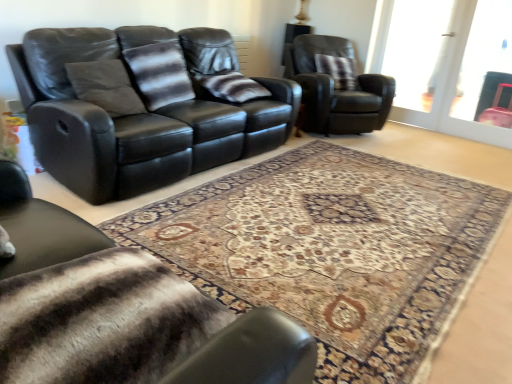
Question: Is patterned carpet at center not within striped fur blanket at lower left, acting as the 2th chair starting from the back?

Choices:
 (A) no
 (B) yes

Answer: (B)

Question: Is patterned carpet at center thinner than striped fur blanket at lower left, the 1th chair from the bottom?

Choices:
 (A) yes
 (B) no

Answer: (B)

Question: Is there a large distance between patterned carpet at center and striped fur blanket at lower left, which ranks as the 1th chair in left-to-right order?

Choices:
 (A) no
 (B) yes

Answer: (B)

Question: From the image's perspective, would you say patterned carpet at center is shown under striped fur blanket at lower left, acting as the 2th chair starting from the back?

Choices:
 (A) no
 (B) yes

Answer: (A)

Question: Is patterned carpet at center with striped fur blanket at lower left, acting as the 2th chair starting from the back?

Choices:
 (A) yes
 (B) no

Answer: (B)

Question: Relative to patterned carpet at center, is striped fabric pillow at center, which is counted as the second pillow, starting from the front, in front or behind?

Choices:
 (A) front
 (B) behind

Answer: (B)

Question: Would you say striped fabric pillow at center, arranged as the 2th pillow when viewed from the left, is to the left or to the right of patterned carpet at center in the picture?

Choices:
 (A) right
 (B) left

Answer: (B)

Question: In terms of size, does striped fabric pillow at center, arranged as the 2th pillow when viewed from the left, appear bigger or smaller than patterned carpet at center?

Choices:
 (A) big
 (B) small

Answer: (B)

Question: From their relative heights in the image, would you say striped fabric pillow at center, which is counted as the second pillow, starting from the front, is taller or shorter than patterned carpet at center?

Choices:
 (A) short
 (B) tall

Answer: (B)

Question: From their relative heights in the image, would you say plush brown pillow at upper right, the 1th pillow viewed from the right, is taller or shorter than striped fur blanket at lower left, positioned as the 2th chair in right-to-left order?

Choices:
 (A) tall
 (B) short

Answer: (A)

Question: Is point (342, 72) closer or farther from the camera than point (292, 331)?

Choices:
 (A) farther
 (B) closer

Answer: (A)

Question: Considering the positions of plush brown pillow at upper right, the 1th pillow viewed from the right, and striped fur blanket at lower left, the 1th chair from the front, in the image, is plush brown pillow at upper right, the 1th pillow viewed from the right, wider or thinner than striped fur blanket at lower left, the 1th chair from the front,?

Choices:
 (A) wide
 (B) thin

Answer: (B)

Question: From a real-world perspective, is plush brown pillow at upper right, the first pillow from the back, physically located above or below striped fur blanket at lower left, which ranks as the 1th chair in left-to-right order?

Choices:
 (A) above
 (B) below

Answer: (A)

Question: Based on their sizes in the image, would you say transparent glass door at upper right is bigger or smaller than black leather couch at upper left?

Choices:
 (A) small
 (B) big

Answer: (A)

Question: Is transparent glass door at upper right situated inside black leather couch at upper left or outside?

Choices:
 (A) inside
 (B) outside

Answer: (B)